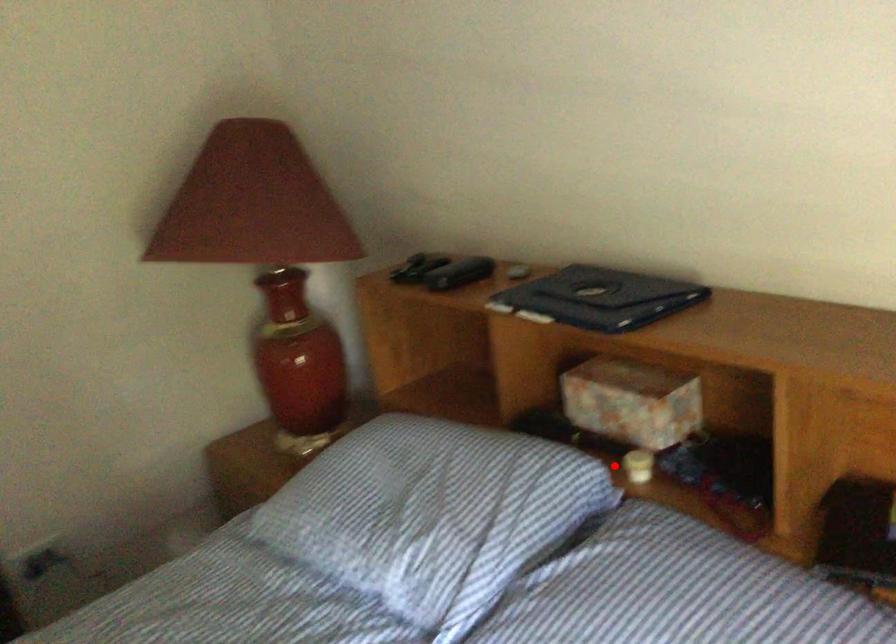
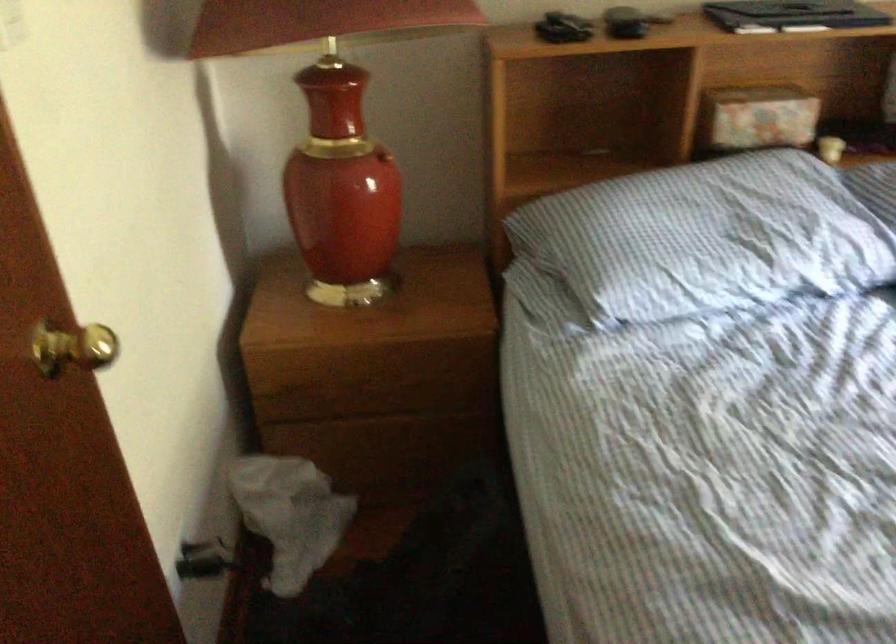
Find the pixel in the second image that matches the highlighted location in the first image.

(830, 149)